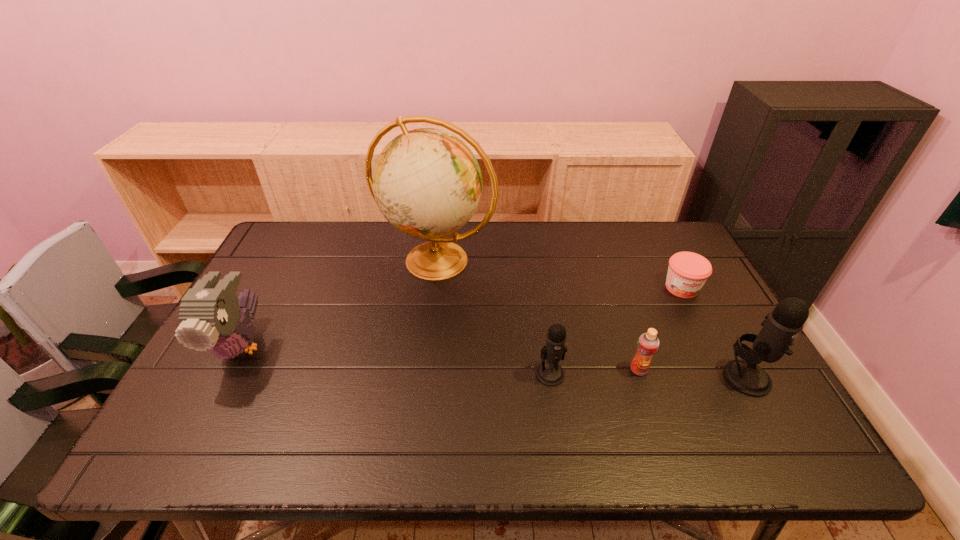
Given the evenly spaced microphones in the image, where should an extra microphone be added on the left to preserve the spacing? Please point to a vacant space. Please provide its 2D coordinates. Your answer should be formatted as a tuple, i.e. [(x, y)], where the tuple contains the x and y coordinates of a point satisfying the conditions above.

[(356, 370)]